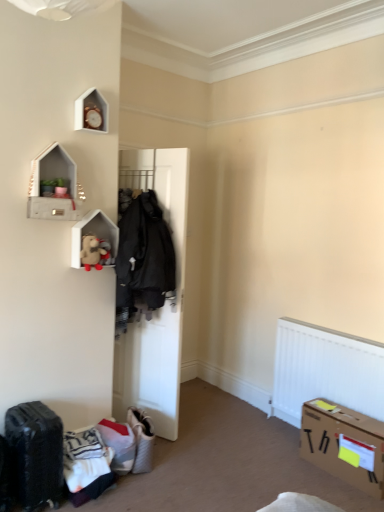
What do you see at coordinates (344, 444) in the screenshot?
I see `cardboard box at lower right` at bounding box center [344, 444].

How much space does concrete textured shelf at upper left, marked as the 1th shelf in a front-to-back arrangement, occupy vertically?

The height of concrete textured shelf at upper left, marked as the 1th shelf in a front-to-back arrangement, is 17.09 inches.

The image size is (384, 512). Describe the element at coordinates (55, 187) in the screenshot. I see `concrete textured shelf at upper left, placed as the second shelf when sorted from back to front` at that location.

The width and height of the screenshot is (384, 512). I want to click on black textured suitcase at lower left, which ranks as the second luggage in right-to-left order, so click(36, 453).

Is white matte wooden shelf at upper left, arranged as the second shelf when viewed from the top, smaller than black textured suitcase at lower left, which is the 2th luggage in back-to-front order?

Yes, white matte wooden shelf at upper left, arranged as the second shelf when viewed from the top, is smaller than black textured suitcase at lower left, which is the 2th luggage in back-to-front order.

From a real-world perspective, is white matte wooden shelf at upper left, which is the first shelf in bottom-to-top order, physically located above or below black textured suitcase at lower left, which ranks as the second luggage in right-to-left order?

Clearly, from a real-world perspective, white matte wooden shelf at upper left, which is the first shelf in bottom-to-top order, is above black textured suitcase at lower left, which ranks as the second luggage in right-to-left order.

Is white matte wooden shelf at upper left, the 2th shelf viewed from the front, aimed at black textured suitcase at lower left, which is the 2th luggage in back-to-front order?

No, white matte wooden shelf at upper left, the 2th shelf viewed from the front, is not facing towards black textured suitcase at lower left, which is the 2th luggage in back-to-front order.

In terms of size, does fuzzy beige teddy bear at upper left appear bigger or smaller than white matte door at center?

Considering their sizes, fuzzy beige teddy bear at upper left takes up less space than white matte door at center.

Is fuzzy beige teddy bear at upper left next to white matte door at center?

No, fuzzy beige teddy bear at upper left is not making contact with white matte door at center.

Is fuzzy beige teddy bear at upper left thinner than white matte door at center?

Indeed, fuzzy beige teddy bear at upper left has a lesser width compared to white matte door at center.

How many degrees apart are the facing directions of fuzzy beige teddy bear at upper left and white matte door at center?

fuzzy beige teddy bear at upper left and white matte door at center are facing 109 degrees away from each other.

Who is shorter, concrete textured shelf at upper left, acting as the 1th shelf starting from the top, or white matte wooden shelf at upper left, the 2th shelf viewed from the front?

white matte wooden shelf at upper left, the 2th shelf viewed from the front, is shorter.

Considering the relative sizes of concrete textured shelf at upper left, the second shelf from the bottom, and white matte wooden shelf at upper left, which ranks as the first shelf in back-to-front order, in the image provided, is concrete textured shelf at upper left, the second shelf from the bottom, wider than white matte wooden shelf at upper left, which ranks as the first shelf in back-to-front order,?

Indeed, concrete textured shelf at upper left, the second shelf from the bottom, has a greater width compared to white matte wooden shelf at upper left, which ranks as the first shelf in back-to-front order.

Considering the positions of objects concrete textured shelf at upper left, the second shelf from the bottom, and white matte wooden shelf at upper left, which ranks as the first shelf in back-to-front order, in the image provided, who is more to the right, concrete textured shelf at upper left, the second shelf from the bottom, or white matte wooden shelf at upper left, which ranks as the first shelf in back-to-front order,?

white matte wooden shelf at upper left, which ranks as the first shelf in back-to-front order, is more to the right.

Considering the relative sizes of concrete textured shelf at upper left, marked as the 1th shelf in a front-to-back arrangement, and white matte wooden shelf at upper left, arranged as the second shelf when viewed from the top, in the image provided, is concrete textured shelf at upper left, marked as the 1th shelf in a front-to-back arrangement, bigger than white matte wooden shelf at upper left, arranged as the second shelf when viewed from the top,?

Yes, concrete textured shelf at upper left, marked as the 1th shelf in a front-to-back arrangement, is bigger than white matte wooden shelf at upper left, arranged as the second shelf when viewed from the top.

Considering the positions of point (84, 240) and point (68, 178), is point (84, 240) closer or farther from the camera than point (68, 178)?

Clearly, point (84, 240) is more distant from the camera than point (68, 178).

Is fuzzy beige teddy bear at upper left placed right next to concrete textured shelf at upper left, the second shelf from the bottom?

No, fuzzy beige teddy bear at upper left is not in contact with concrete textured shelf at upper left, the second shelf from the bottom.

Find the location of a particular element. The image size is (384, 512). toy located on the right of concrete textured shelf at upper left, acting as the 1th shelf starting from the top is located at coordinates (94, 252).

Is fuzzy beige teddy bear at upper left not inside concrete textured shelf at upper left, acting as the 1th shelf starting from the top?

Yes, fuzzy beige teddy bear at upper left is located beyond the bounds of concrete textured shelf at upper left, acting as the 1th shelf starting from the top.

Which of these two, white textured fabric suitcase at lower center, which is the 2th luggage in left-to-right order, or white matte wooden shelf at upper left, which is the first shelf in bottom-to-top order, is smaller?

Smaller between the two is white matte wooden shelf at upper left, which is the first shelf in bottom-to-top order.

Based on the photo, considering the positions of objects white textured fabric suitcase at lower center, which is the 2th luggage in left-to-right order, and white matte wooden shelf at upper left, which ranks as the first shelf in back-to-front order, in the image provided, who is in front, white textured fabric suitcase at lower center, which is the 2th luggage in left-to-right order, or white matte wooden shelf at upper left, which ranks as the first shelf in back-to-front order,?

white matte wooden shelf at upper left, which ranks as the first shelf in back-to-front order, is closer to the camera.

Is point (136, 410) closer or farther from the camera than point (80, 266)?

Point (136, 410) is positioned farther from the camera compared to point (80, 266).

Is white textured fabric suitcase at lower center, the 2th luggage from the front, positioned beyond the bounds of white matte wooden shelf at upper left, which ranks as the first shelf in back-to-front order?

That's correct, white textured fabric suitcase at lower center, the 2th luggage from the front, is outside of white matte wooden shelf at upper left, which ranks as the first shelf in back-to-front order.

Based on the photo, how different are the orientations of black textured suitcase at lower left, which ranks as the second luggage in right-to-left order, and white matte wooden shelf at upper left, which is the first shelf in bottom-to-top order, in degrees?

They differ by 2.51 degrees in their facing directions.

From a real-world perspective, starting from the black textured suitcase at lower left, which is the first luggage in front-to-back order, which shelf is the 1st one vertically above it? Please provide its 2D coordinates.

[(93, 233)]

From the image's perspective, which is above, black textured suitcase at lower left, positioned as the 1th luggage in left-to-right order, or white matte wooden shelf at upper left, which is the first shelf in bottom-to-top order?

white matte wooden shelf at upper left, which is the first shelf in bottom-to-top order, from the image's perspective.

From a real-world perspective, does black textured suitcase at lower left, which ranks as the second luggage in right-to-left order, stand above white matte wooden shelf at upper left, arranged as the second shelf when viewed from the top?

No, from a real-world perspective, black textured suitcase at lower left, which ranks as the second luggage in right-to-left order, is not on top of white matte wooden shelf at upper left, arranged as the second shelf when viewed from the top.

Is point (374, 453) closer to camera compared to point (106, 247)?

Yes, point (374, 453) is closer to viewer.

How different are the orientations of cardboard box at lower right and fuzzy beige teddy bear at upper left in degrees?

92 degrees.

Is cardboard box at lower right facing away from fuzzy beige teddy bear at upper left?

No, cardboard box at lower right is not facing away from fuzzy beige teddy bear at upper left.

Does cardboard box at lower right touch fuzzy beige teddy bear at upper left?

cardboard box at lower right and fuzzy beige teddy bear at upper left are clearly separated.

You are a GUI agent. You are given a task and a screenshot of the screen. Output one action in this format:
    pyautogui.click(x=<x>, y=<y>)
    Task: Click on the 2nd shelf to the right of the black textured suitcase at lower left, which is the 2th luggage in back-to-front order, counting from the anchor's position
    The height and width of the screenshot is (512, 384).
    Given the screenshot: What is the action you would take?
    pyautogui.click(x=93, y=233)

Where is `toy in front of the white matte door at center`? The image size is (384, 512). toy in front of the white matte door at center is located at coordinates (94, 252).

Which object lies further to the anchor point cardboard box at lower right, white matte wooden shelf at upper left, which is the first shelf in bottom-to-top order, or fuzzy beige teddy bear at upper left?

fuzzy beige teddy bear at upper left.

Looking at the image, which one is located closer to cardboard box at lower right, concrete textured shelf at upper left, placed as the second shelf when sorted from back to front, or white textured fabric suitcase at lower center, which is the 1th luggage from right to left?

white textured fabric suitcase at lower center, which is the 1th luggage from right to left.

Looking at the image, which one is located further to white matte door at center, cardboard box at lower right or black textured suitcase at lower left, which is the first luggage in front-to-back order?

cardboard box at lower right.

Looking at the image, which one is located further to concrete textured shelf at upper left, marked as the 1th shelf in a front-to-back arrangement, cardboard box at lower right or white matte wooden shelf at upper left, which ranks as the first shelf in back-to-front order?

The object further to concrete textured shelf at upper left, marked as the 1th shelf in a front-to-back arrangement, is cardboard box at lower right.

When comparing their distances from concrete textured shelf at upper left, the second shelf from the bottom, does white textured fabric suitcase at lower center, which is the 1th luggage from right to left, or black textured suitcase at lower left, which is the 2th luggage in back-to-front order, seem closer?

Among the two, black textured suitcase at lower left, which is the 2th luggage in back-to-front order, is located nearer to concrete textured shelf at upper left, the second shelf from the bottom.

Which object lies nearer to the anchor point cardboard box at lower right, white textured fabric suitcase at lower center, the 1th luggage positioned from the back, or concrete textured shelf at upper left, marked as the 1th shelf in a front-to-back arrangement?

white textured fabric suitcase at lower center, the 1th luggage positioned from the back, is closer to cardboard box at lower right.

When comparing their distances from white matte wooden shelf at upper left, which is the first shelf in bottom-to-top order, does white matte door at center or white textured fabric suitcase at lower center, which is the 2th luggage in left-to-right order, seem further?

Based on the image, white textured fabric suitcase at lower center, which is the 2th luggage in left-to-right order, appears to be further to white matte wooden shelf at upper left, which is the first shelf in bottom-to-top order.

Based on the photo, when comparing their distances from white textured fabric suitcase at lower center, which is the 1th luggage from right to left, does concrete textured shelf at upper left, acting as the 1th shelf starting from the top, or white matte wooden shelf at upper left, arranged as the second shelf when viewed from the top, seem further?

concrete textured shelf at upper left, acting as the 1th shelf starting from the top, is positioned further to the anchor white textured fabric suitcase at lower center, which is the 1th luggage from right to left.

Find the location of a particular element. luggage situated between black textured suitcase at lower left, which is the 2th luggage in back-to-front order, and cardboard box at lower right from left to right is located at coordinates (141, 440).

You are a GUI agent. You are given a task and a screenshot of the screen. Output one action in this format:
    pyautogui.click(x=<x>, y=<y>)
    Task: Click on the luggage between concrete textured shelf at upper left, acting as the 1th shelf starting from the top, and white textured fabric suitcase at lower center, which is the 1th luggage from right to left, from top to bottom
    
    Given the screenshot: What is the action you would take?
    [36, 453]

This screenshot has width=384, height=512. I want to click on luggage that lies between white matte wooden shelf at upper left, which is the first shelf in bottom-to-top order, and white textured fabric suitcase at lower center, the 2th luggage from the front, from top to bottom, so click(x=36, y=453).

In order to click on toy between concrete textured shelf at upper left, marked as the 1th shelf in a front-to-back arrangement, and white matte door at center in the up-down direction in this screenshot , I will do `click(94, 252)`.